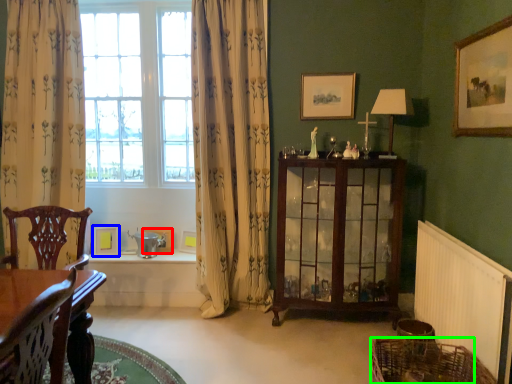
Question: Based on their relative distances, which object is farther from picture frame (highlighted by a red box)? Choose from picture frame (highlighted by a blue box) and basket (highlighted by a green box).

Choices:
 (A) picture frame
 (B) basket

Answer: (B)